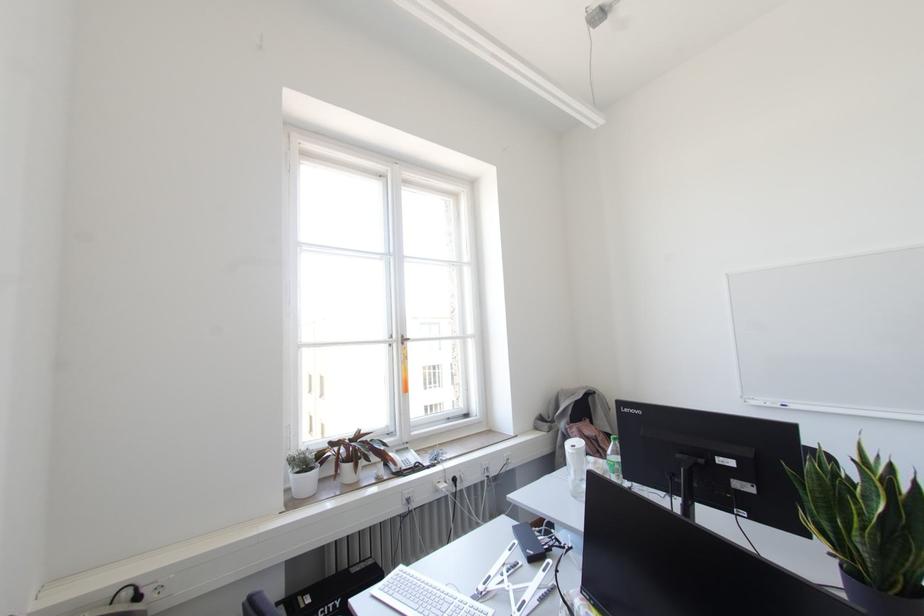
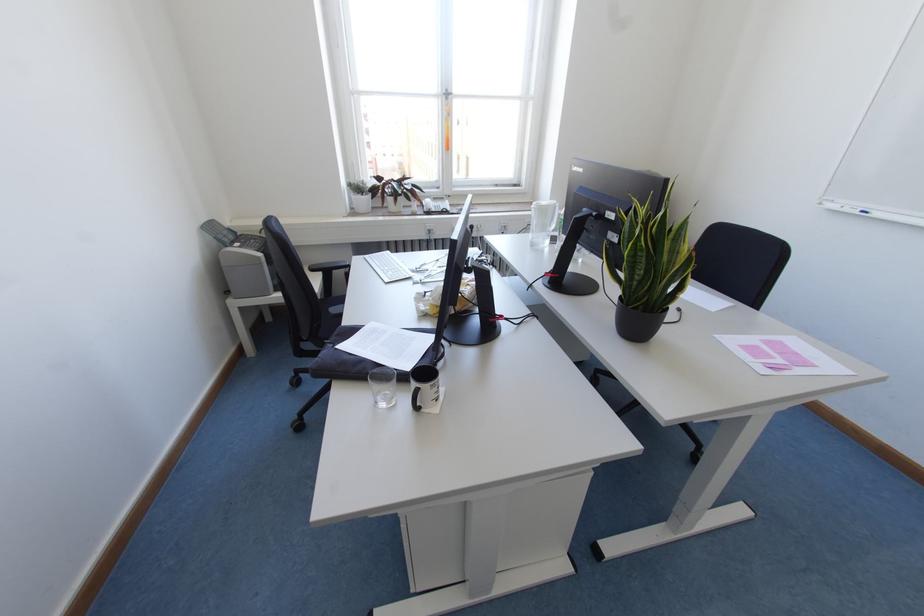
In the second image, find the point that corresponds to point (402, 342) in the first image.

(446, 98)